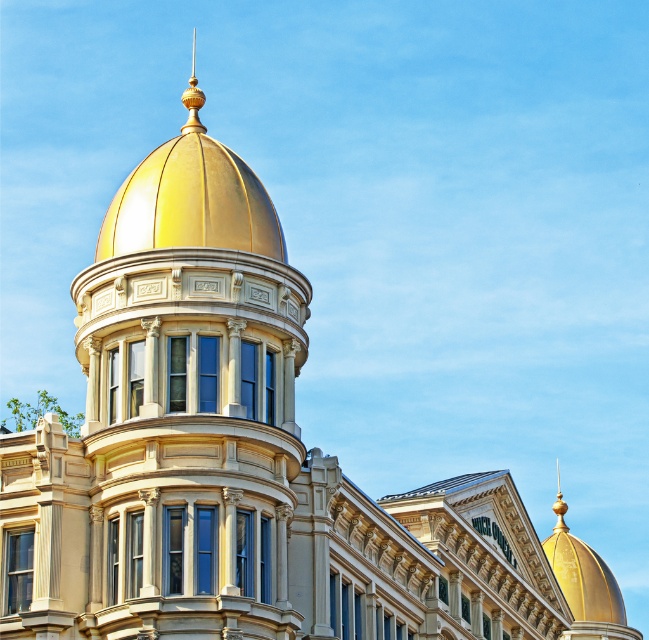
Question: Can you confirm if gold polished dome at center is positioned to the right of gold polished spire at upper center?

Choices:
 (A) no
 (B) yes

Answer: (B)

Question: Which point is farther to the camera?

Choices:
 (A) gold polished spire at upper center
 (B) gold polished dome at center

Answer: (A)

Question: Is gold polished dome at center in front of gold polished spire at upper center?

Choices:
 (A) no
 (B) yes

Answer: (B)

Question: Which object is farther from the camera taking this photo?

Choices:
 (A) gold polished dome at center
 (B) gold polished spire at upper center

Answer: (B)

Question: From the image, what is the correct spatial relationship of gold polished dome at center in relation to gold polished spire at upper center?

Choices:
 (A) right
 (B) left

Answer: (A)